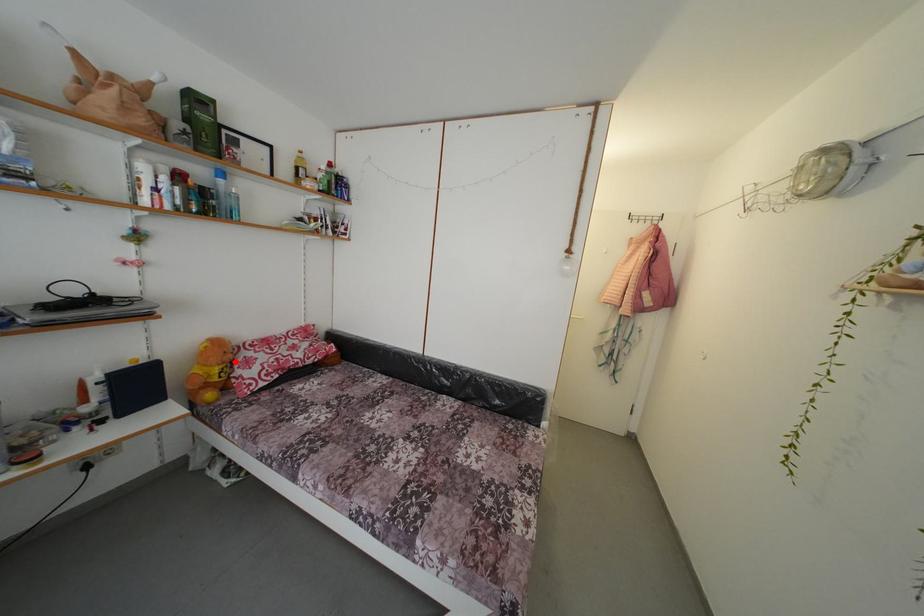
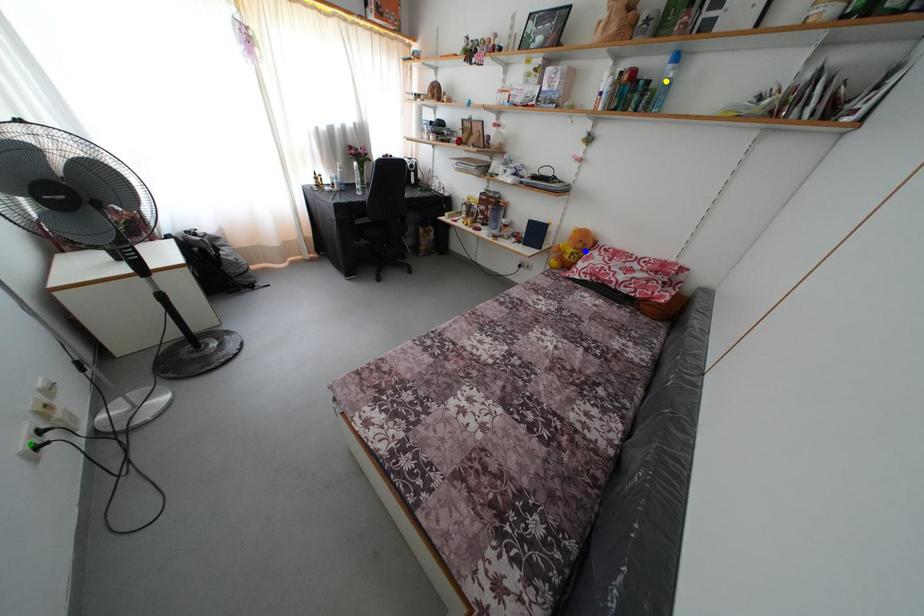
Question: I am providing you with two images of the same scene from different viewpoints. A red point is marked on the first image. You are given multiple points on the second image. Which mark in image 2 goes with the point in image 1?

Choices:
 (A) blue point
 (B) yellow point
 (C) green point

Answer: (A)